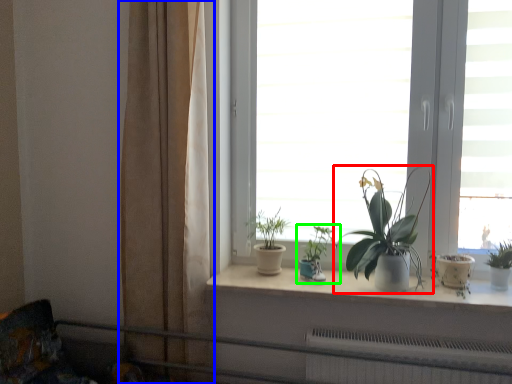
Question: Considering the real-world distances, which object is farthest from houseplant (highlighted by a red box)? curtain (highlighted by a blue box) or houseplant (highlighted by a green box)?

Choices:
 (A) curtain
 (B) houseplant

Answer: (A)